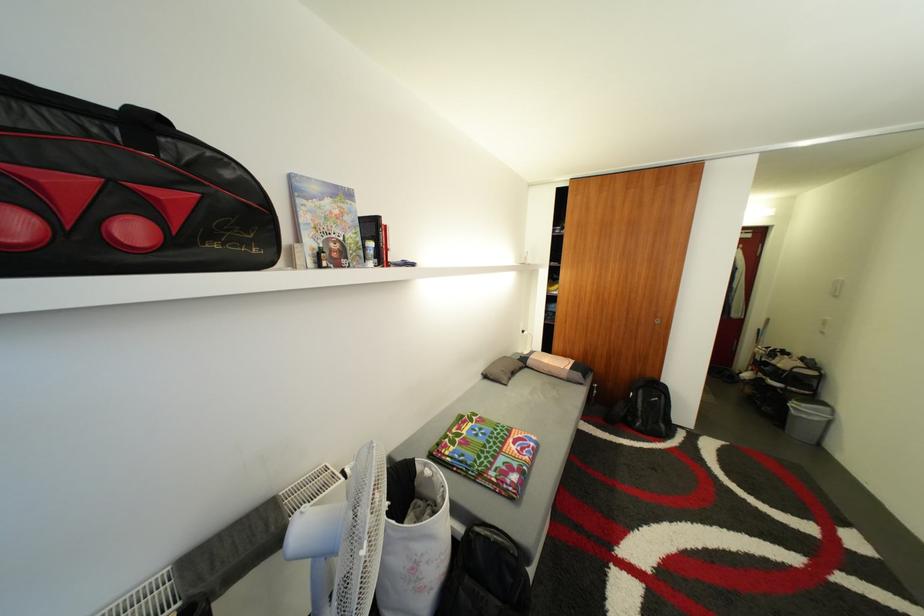
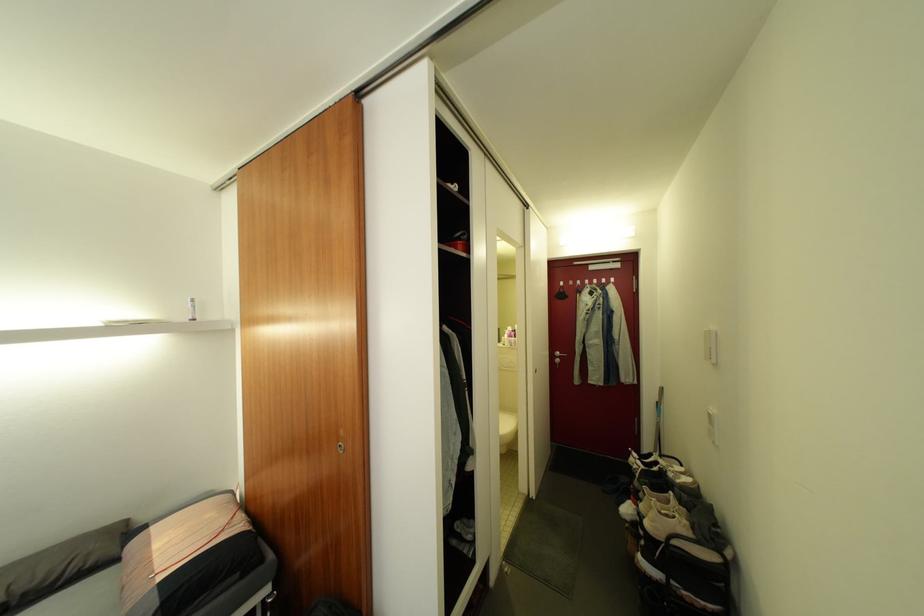
In a continuous first-person perspective shot, in which direction is the camera moving?

The movement direction of the cameraman is right, forward.